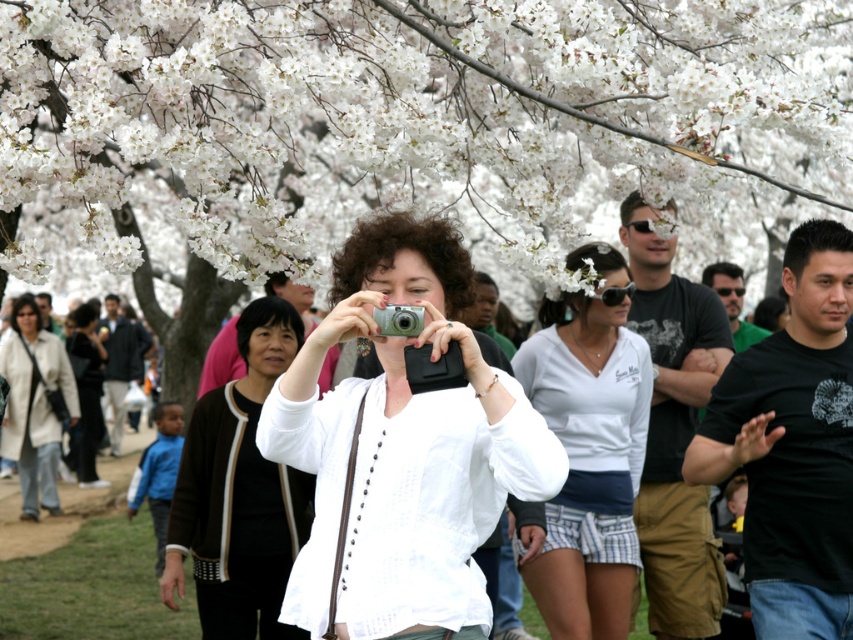
Describe the element at coordinates (416, 120) in the screenshot. I see `white blossoms at center` at that location.

What are the coordinates of `white blossoms at center` in the screenshot? It's located at (416, 120).

Locate an element on the screen. This screenshot has height=640, width=853. white blossoms at center is located at coordinates (416, 120).

Does black matte shirt at center appear on the left side of matte black sunglasses at upper right?

In fact, black matte shirt at center is to the right of matte black sunglasses at upper right.

Does black matte shirt at center have a larger size compared to matte black sunglasses at upper right?

No.

Is point (810, 348) positioned after point (694, 397)?

No.

Identify the location of black matte shirt at center. (793, 445).

This screenshot has height=640, width=853. Describe the element at coordinates (674, 428) in the screenshot. I see `matte black sunglasses at upper right` at that location.

This screenshot has width=853, height=640. I want to click on matte black sunglasses at upper right, so (x=674, y=428).